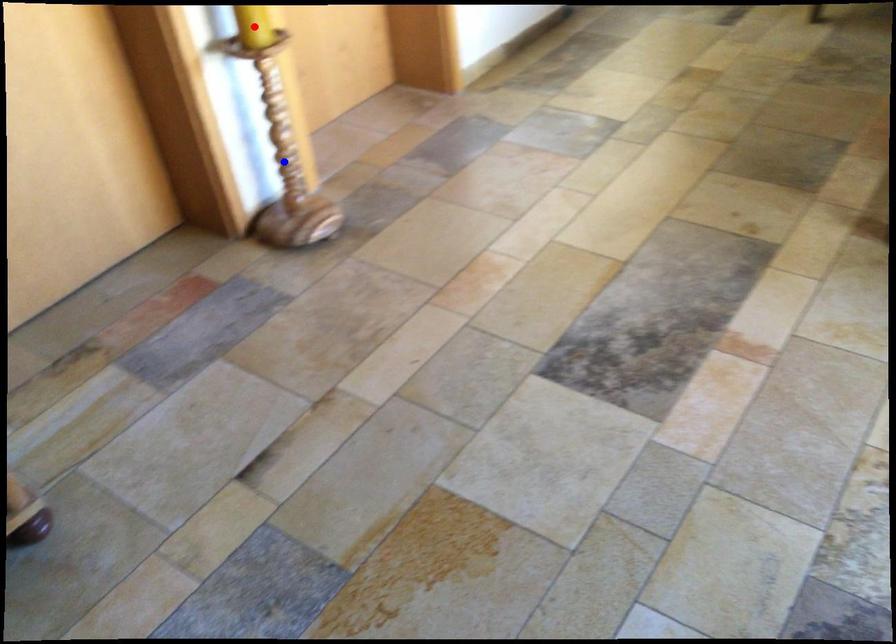
Question: In the image, two points are highlighted. Which point is nearer to the camera? Reply with the corresponding letter.

Choices:
 (A) blue point
 (B) red point

Answer: (B)